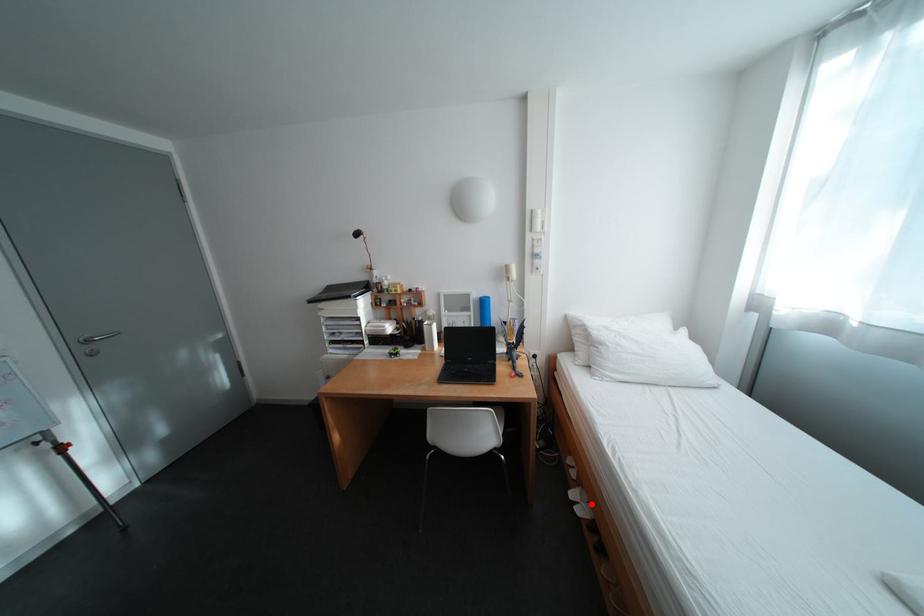
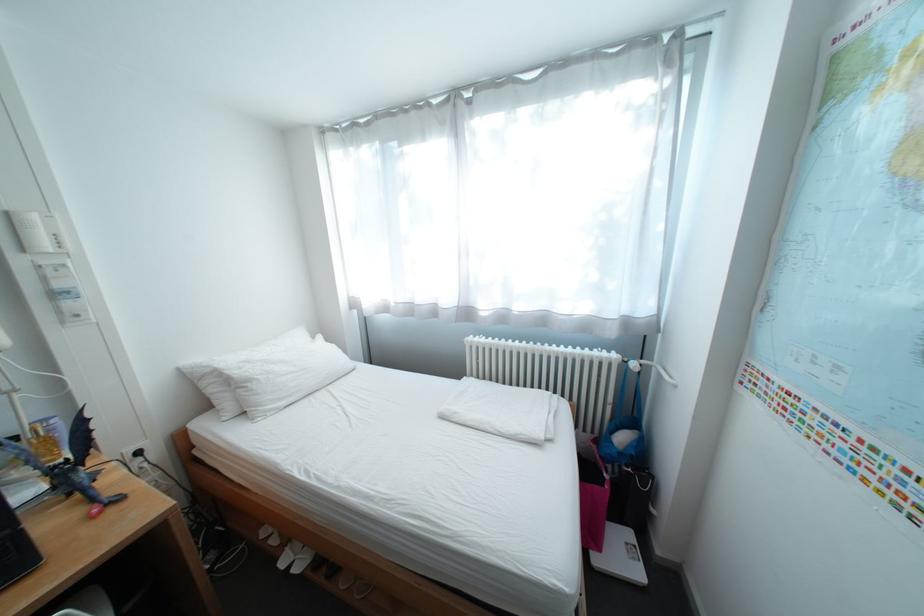
Where in the second image is the point corresponding to the highlighted location from the first image?

(307, 562)